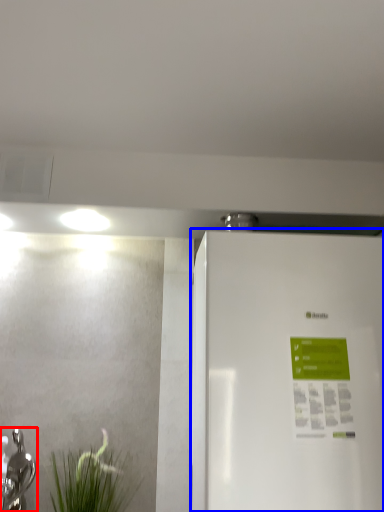
Question: Which point is further to the camera, tap (highlighted by a red box) or refrigerator (highlighted by a blue box)?

Choices:
 (A) tap
 (B) refrigerator

Answer: (A)